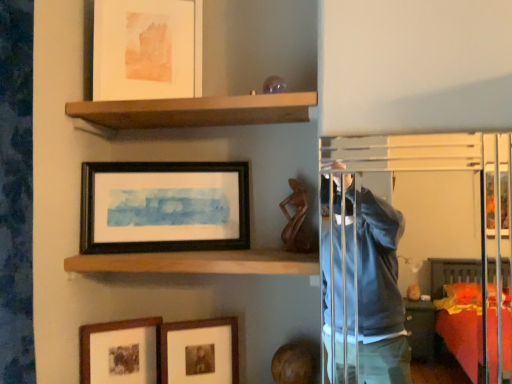
Question: Is the position of wooden head at lower center less distant than that of matte wooden picture frame at lower left, marked as the 1th picture frame in a bottom-to-top arrangement?

Choices:
 (A) yes
 (B) no

Answer: (A)

Question: Can you confirm if wooden head at lower center is taller than matte wooden picture frame at lower left, marked as the 1th picture frame in a bottom-to-top arrangement?

Choices:
 (A) no
 (B) yes

Answer: (A)

Question: Does wooden head at lower center lie behind matte wooden picture frame at lower left, the fourth picture frame from the top?

Choices:
 (A) yes
 (B) no

Answer: (B)

Question: From the image's perspective, is wooden head at lower center on matte wooden picture frame at lower left, marked as the 1th picture frame in a bottom-to-top arrangement?

Choices:
 (A) yes
 (B) no

Answer: (B)

Question: Is matte wooden picture frame at lower left, the fourth picture frame from the top, inside wooden head at lower center?

Choices:
 (A) no
 (B) yes

Answer: (A)

Question: Is wooden head at lower center wider than matte wooden picture frame at lower left, marked as the 1th picture frame in a bottom-to-top arrangement?

Choices:
 (A) yes
 (B) no

Answer: (A)

Question: Can you confirm if matte paper picture frame at upper center, the first picture frame when ordered from top to bottom, is positioned to the left of wooden shelf at center, the 2th shelf positioned from the top?

Choices:
 (A) no
 (B) yes

Answer: (B)

Question: From the image's perspective, is matte paper picture frame at upper center, the 4th picture frame in the bottom-to-top sequence, located beneath wooden shelf at center, which is counted as the first shelf, starting from the bottom?

Choices:
 (A) no
 (B) yes

Answer: (A)

Question: From a real-world perspective, is matte paper picture frame at upper center, the first picture frame when ordered from top to bottom, on wooden shelf at center, which is counted as the first shelf, starting from the bottom?

Choices:
 (A) no
 (B) yes

Answer: (B)

Question: Is wooden shelf at center, the 2th shelf positioned from the top, surrounded by matte paper picture frame at upper center, the first picture frame when ordered from top to bottom?

Choices:
 (A) yes
 (B) no

Answer: (B)

Question: Does matte paper picture frame at upper center, the 4th picture frame in the bottom-to-top sequence, appear on the right side of wooden shelf at center, which is counted as the first shelf, starting from the bottom?

Choices:
 (A) no
 (B) yes

Answer: (A)

Question: Can you confirm if matte paper picture frame at upper center, the first picture frame when ordered from top to bottom, is smaller than wooden shelf at center, the 2th shelf positioned from the top?

Choices:
 (A) no
 (B) yes

Answer: (B)

Question: Is matte paper picture frame at upper center, the first picture frame when ordered from top to bottom, completely or partially inside matte wooden picture frame at lower center, which appears as the 2th picture frame when ordered from the bottom?

Choices:
 (A) yes
 (B) no

Answer: (B)